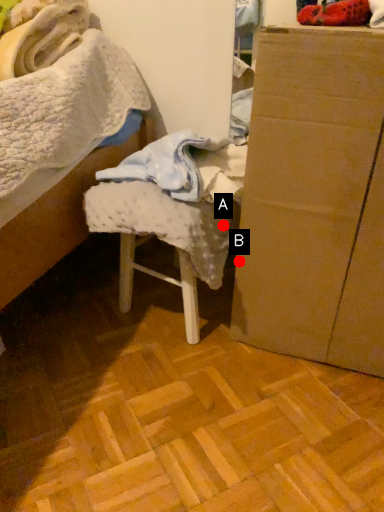
Question: Two points are circled on the image, labeled by A and B beside each circle. Among these points, which one is farthest from the camera?

Choices:
 (A) A is further
 (B) B is further

Answer: (B)